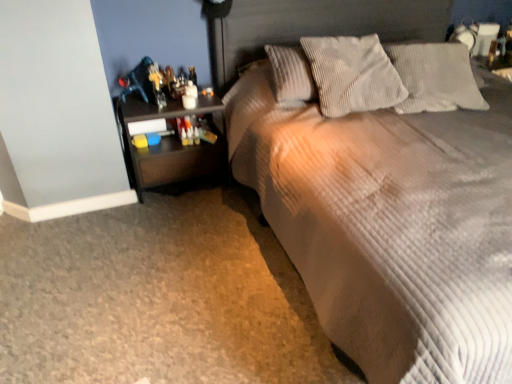
Question: Is dark wood nightstand at left surrounded by gray corduroy pillow at upper center, which is the first pillow from right to left?

Choices:
 (A) no
 (B) yes

Answer: (A)

Question: Is gray corduroy pillow at upper center, which is the first pillow from right to left, oriented towards dark wood nightstand at left?

Choices:
 (A) yes
 (B) no

Answer: (B)

Question: Considering the relative sizes of gray corduroy pillow at upper center, the 2th pillow when ordered from left to right, and dark wood nightstand at left in the image provided, is gray corduroy pillow at upper center, the 2th pillow when ordered from left to right, shorter than dark wood nightstand at left?

Choices:
 (A) no
 (B) yes

Answer: (B)

Question: From the image's perspective, is gray corduroy pillow at upper center, the 2th pillow when ordered from left to right, above dark wood nightstand at left?

Choices:
 (A) yes
 (B) no

Answer: (A)

Question: Does gray corduroy pillow at upper center, the 2th pillow when ordered from left to right, lie in front of dark wood nightstand at left?

Choices:
 (A) no
 (B) yes

Answer: (B)

Question: Based on their positions, is corduroy pillow at upper center, which is the second pillow from right to left, located to the left or right of gray corduroy pillow at upper center, which is the first pillow from right to left?

Choices:
 (A) left
 (B) right

Answer: (A)

Question: In terms of height, does corduroy pillow at upper center, the first pillow from the left, look taller or shorter compared to gray corduroy pillow at upper center, which is the first pillow from right to left?

Choices:
 (A) tall
 (B) short

Answer: (A)

Question: Do you think corduroy pillow at upper center, which is the second pillow from right to left, is within gray corduroy pillow at upper center, which is the first pillow from right to left, or outside of it?

Choices:
 (A) outside
 (B) inside

Answer: (A)

Question: Relative to gray corduroy pillow at upper center, the 2th pillow when ordered from left to right, is corduroy pillow at upper center, the first pillow from the left, in front or behind?

Choices:
 (A) front
 (B) behind

Answer: (A)

Question: From the image's perspective, is dark wood nightstand at left above or below gray corduroy pillow at upper center, the 2th pillow when ordered from left to right?

Choices:
 (A) below
 (B) above

Answer: (A)

Question: Is dark wood nightstand at left situated inside gray corduroy pillow at upper center, which is the first pillow from right to left, or outside?

Choices:
 (A) inside
 (B) outside

Answer: (B)

Question: Is point (132, 102) closer or farther from the camera than point (404, 79)?

Choices:
 (A) farther
 (B) closer

Answer: (A)

Question: Would you say dark wood nightstand at left is to the left or to the right of gray corduroy pillow at upper center, the 2th pillow when ordered from left to right, in the picture?

Choices:
 (A) right
 (B) left

Answer: (B)

Question: Choose the correct answer: Is dark wood nightstand at left inside corduroy fabric bed at center or outside it?

Choices:
 (A) inside
 (B) outside

Answer: (B)

Question: From a real-world perspective, is dark wood nightstand at left physically located above or below corduroy fabric bed at center?

Choices:
 (A) above
 (B) below

Answer: (B)